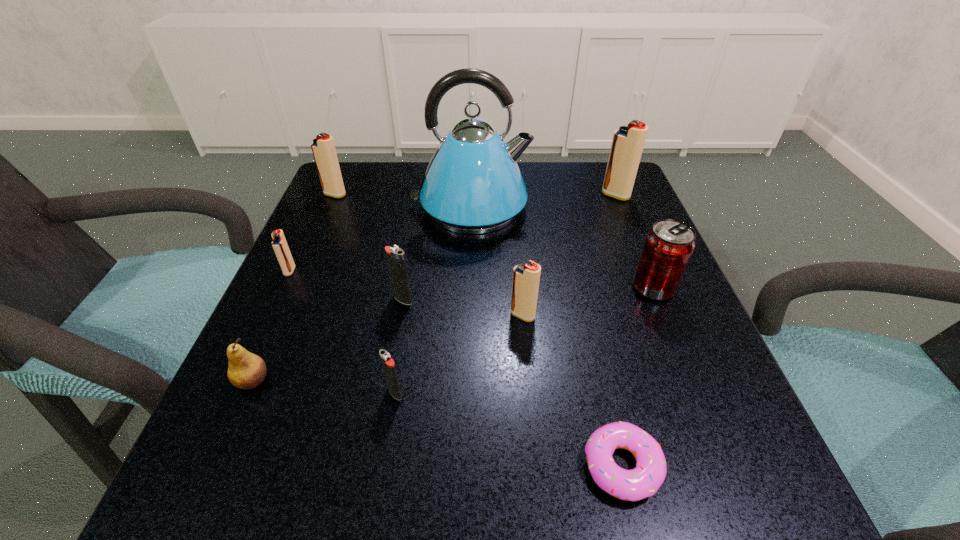
Find the location of a particular element. The image size is (960, 540). the fourth nearest igniter is located at coordinates point(279,243).

Locate an element on the screen. the smallest red igniter is located at coordinates (279, 243).

You are a GUI agent. You are given a task and a screenshot of the screen. Output one action in this format:
    pyautogui.click(x=<x>, y=<y>)
    Task: Click on the nearest igniter
    This screenshot has height=540, width=960.
    Given the screenshot: What is the action you would take?
    [388, 364]

The width and height of the screenshot is (960, 540). I want to click on the smaller black igniter, so click(388, 364).

I want to click on the third object from right to left, so click(x=636, y=484).

Image resolution: width=960 pixels, height=540 pixels. I want to click on the shortest object, so click(x=636, y=484).

Identify the location of vacant space located at the spout of the kettle. The width and height of the screenshot is (960, 540). (626, 207).

Where is `blank area located on the front of the tallest igniter`? The height and width of the screenshot is (540, 960). blank area located on the front of the tallest igniter is located at coordinates (643, 262).

Find the location of `vacant area situated 0.310m on the right of the fifth shortest igniter`. vacant area situated 0.310m on the right of the fifth shortest igniter is located at coordinates (479, 194).

Locate an element on the screen. This screenshot has height=540, width=960. free space located 0.170m on the back of the pop soda is located at coordinates (626, 220).